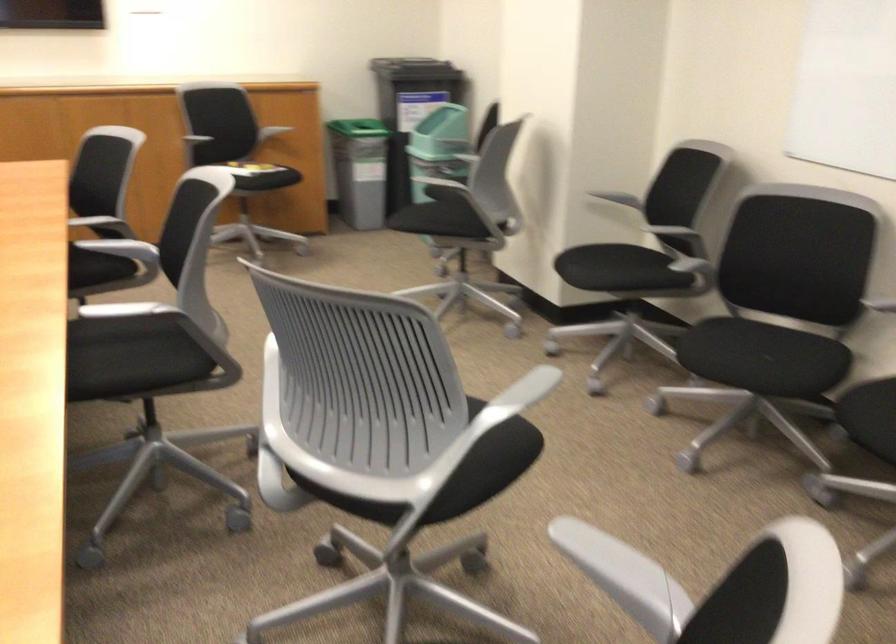
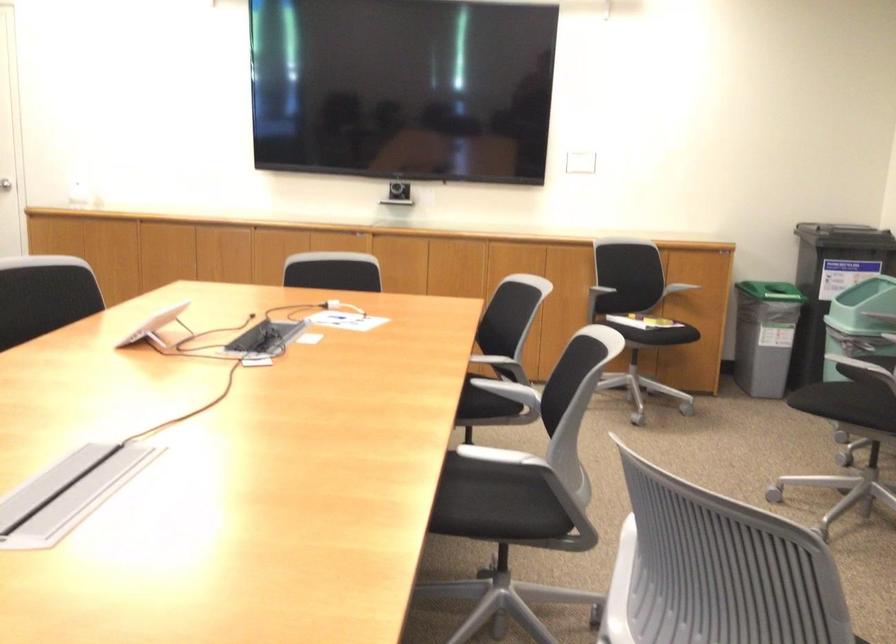
The point at (175, 146) is marked in the first image. Where is the corresponding point in the second image?

(571, 290)